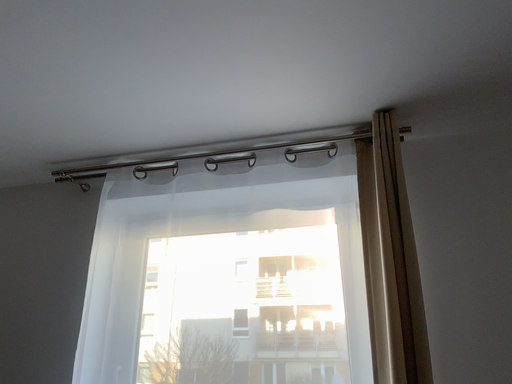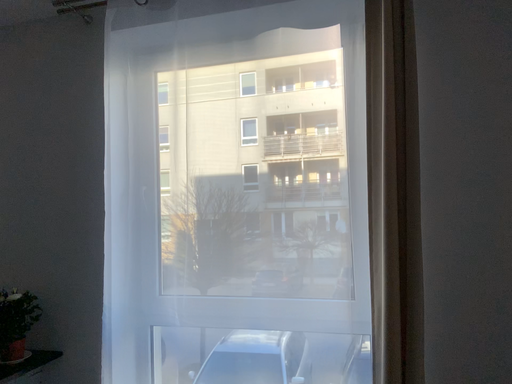
Question: Which way did the camera rotate in the video?

Choices:
 (A) rotated downward
 (B) rotated upward

Answer: (A)